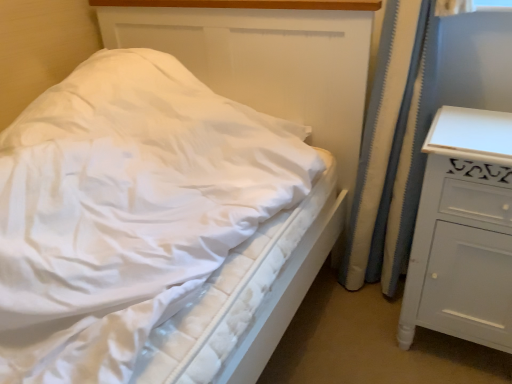
Locate an element on the screen. Image resolution: width=512 pixels, height=384 pixels. blank space situated above white painted wood chest of drawers at right (from a real-world perspective) is located at coordinates (479, 122).